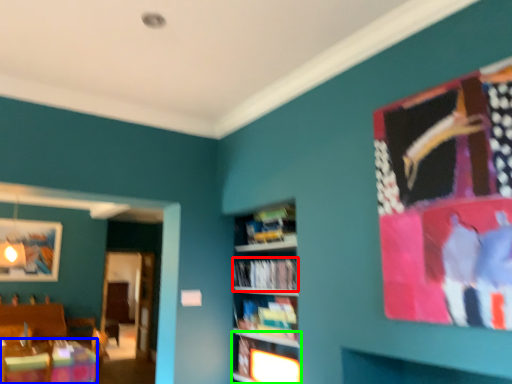
Question: Considering the real-world distances, which object is farthest from book (highlighted by a red box)? table (highlighted by a blue box) or shelf (highlighted by a green box)?

Choices:
 (A) table
 (B) shelf

Answer: (A)